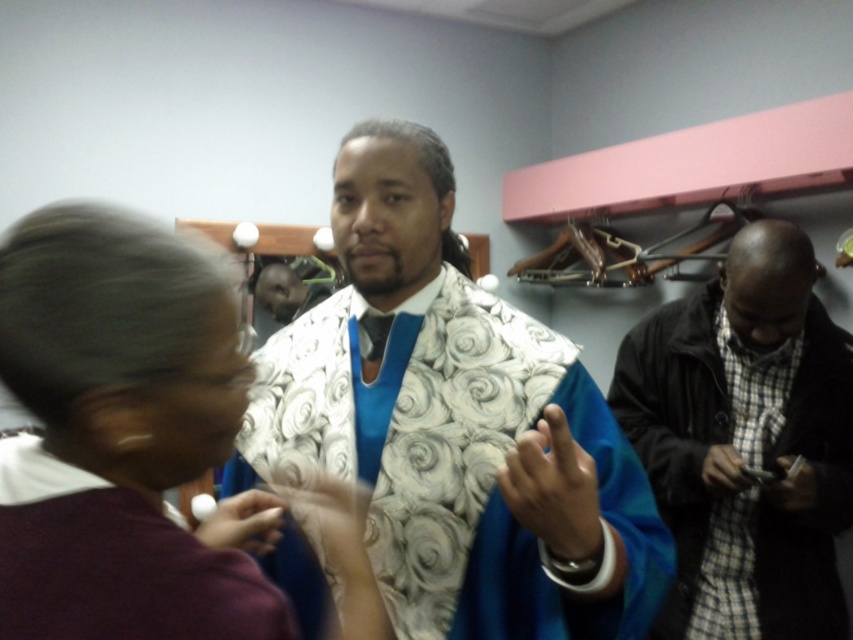
Question: Which object appears closest to the camera in this image?

Choices:
 (A) matte floral robe at center
 (B) plaid fabric shirt at right
 (C) blue satin robe at center
 (D) purple fabric at center

Answer: (C)

Question: Does plaid fabric shirt at right appear over blue satin robe at center?

Choices:
 (A) no
 (B) yes

Answer: (A)

Question: Observing the image, what is the correct spatial positioning of matte floral robe at center in reference to blue satin robe at center?

Choices:
 (A) left
 (B) right

Answer: (B)

Question: Can you confirm if matte floral robe at center is bigger than plaid fabric shirt at right?

Choices:
 (A) yes
 (B) no

Answer: (A)

Question: Which object appears closest to the camera in this image?

Choices:
 (A) plaid fabric shirt at right
 (B) matte floral robe at center
 (C) purple fabric at center

Answer: (C)

Question: Which object is closer to the camera taking this photo?

Choices:
 (A) blue satin robe at center
 (B) purple fabric at center
 (C) plaid fabric shirt at right
 (D) matte floral robe at center

Answer: (A)